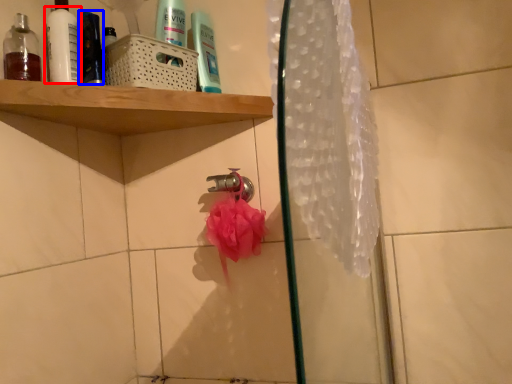
Question: Among these objects, which one is farthest to the camera, mouthwash (highlighted by a red box) or toiletry (highlighted by a blue box)?

Choices:
 (A) mouthwash
 (B) toiletry

Answer: (B)